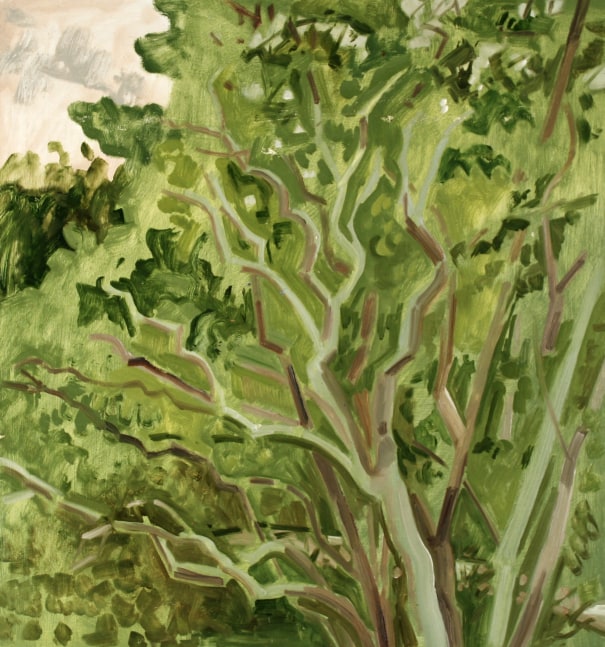
Locate an element on the screen. The height and width of the screenshot is (647, 605). oil painting is located at coordinates (468, 192).